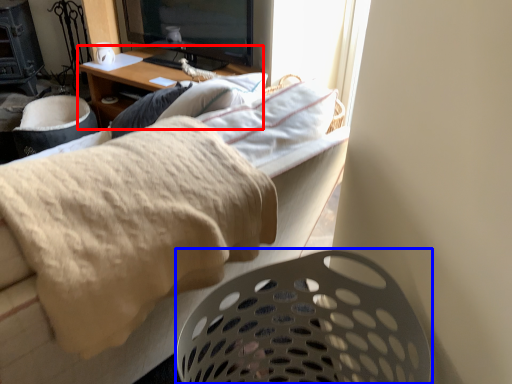
Question: Which object appears farthest to the camera in this image, desk (highlighted by a red box) or laundry basket (highlighted by a blue box)?

Choices:
 (A) desk
 (B) laundry basket

Answer: (A)